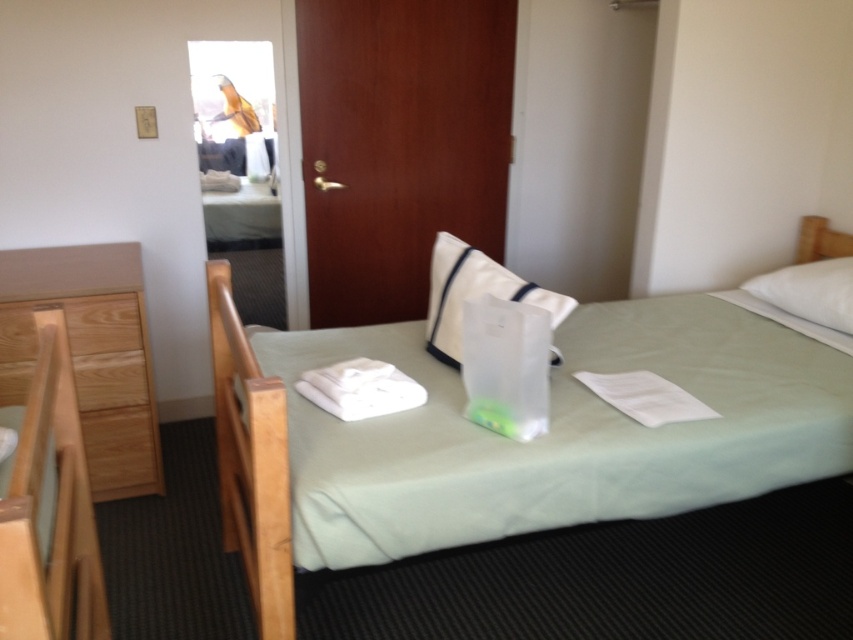
Question: Which point is farther to the camera?

Choices:
 (A) (775, 300)
 (B) (445, 269)
 (C) (276, 563)

Answer: (A)

Question: Considering the real-world distances, which object is closest to the white fabric pillow at center?

Choices:
 (A) white soft pillow at upper right
 (B) light brown wood dresser at left
 (C) green fabric bed at center

Answer: (C)

Question: Does white fabric pillow at center have a smaller size compared to white soft pillow at upper right?

Choices:
 (A) no
 (B) yes

Answer: (A)

Question: Does light brown wood dresser at left come behind white fabric pillow at center?

Choices:
 (A) no
 (B) yes

Answer: (B)

Question: Which of the following is the closest to the observer?

Choices:
 (A) green fabric bed at center
 (B) white soft pillow at upper right
 (C) light brown wood dresser at left
 (D) white fabric pillow at center

Answer: (A)

Question: Observing the image, what is the correct spatial positioning of green fabric bed at center in reference to white fabric pillow at center?

Choices:
 (A) below
 (B) above

Answer: (A)